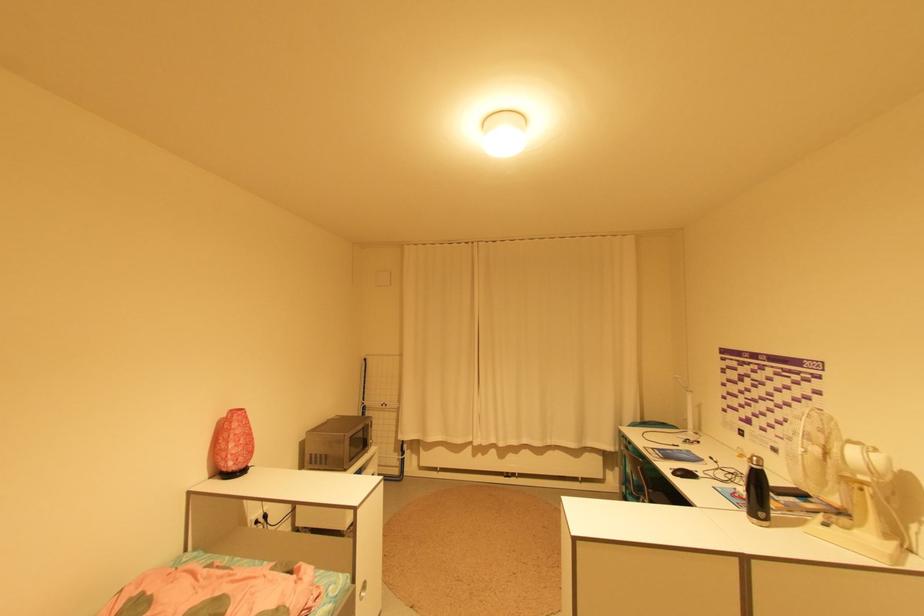
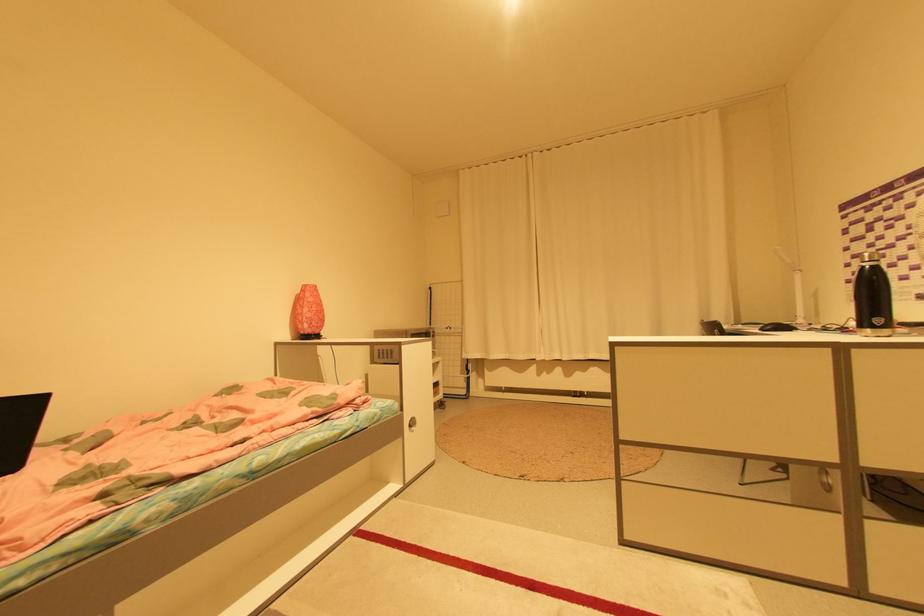
Locate, in the second image, the point that corresponds to the point at 773,524 in the first image.

(893, 331)